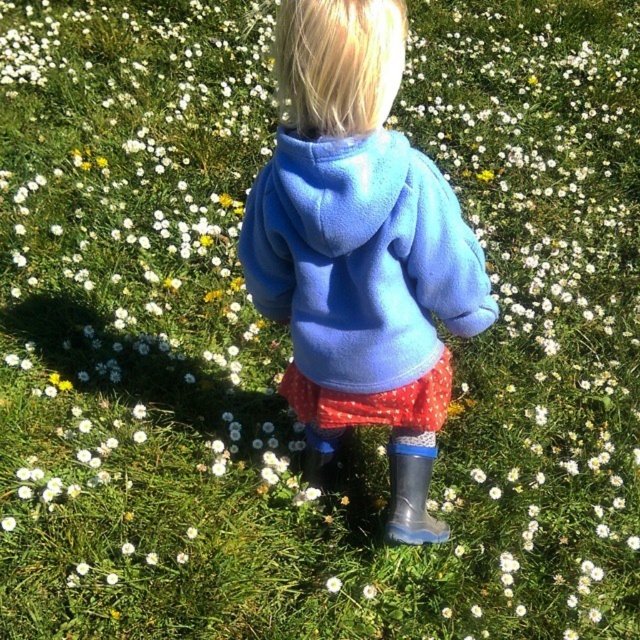
Question: Which object is positioned farthest from the white fluffy flower at center?

Choices:
 (A) matte blue sweatshirt at center
 (B) transparent rubber boot at lower right
 (C) blue fleece hoodie at center

Answer: (A)

Question: Among these points, which one is farthest from the camera?

Choices:
 (A) (273, 308)
 (B) (337, 588)
 (C) (241, 230)

Answer: (C)

Question: Can you confirm if blue fleece hoodie at center is positioned above transparent rubber boot at lower right?

Choices:
 (A) no
 (B) yes

Answer: (B)

Question: Can you confirm if blue fleece hoodie at center is positioned above matte blue sweatshirt at center?

Choices:
 (A) no
 (B) yes

Answer: (A)

Question: Does matte blue sweatshirt at center appear on the left side of white fluffy flower at center?

Choices:
 (A) yes
 (B) no

Answer: (B)

Question: Which of the following is the farthest from the observer?

Choices:
 (A) [x=384, y=16]
 (B) [x=438, y=525]
 (C) [x=289, y=170]
 (D) [x=339, y=586]

Answer: (B)